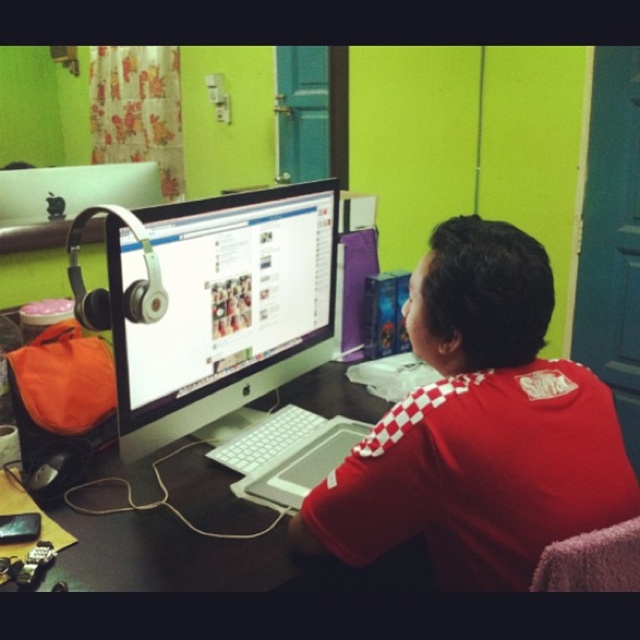
Question: Does red checkered shirt at center appear over white plastic keyboard at center?

Choices:
 (A) no
 (B) yes

Answer: (B)

Question: Which of the following is the farthest from the observer?

Choices:
 (A) (122, 504)
 (B) (292, 406)
 (C) (132, 433)

Answer: (B)

Question: Considering the real-world distances, which object is closest to the white plastic keyboard at center?

Choices:
 (A) red checkered shirt at center
 (B) black glossy table at center

Answer: (B)

Question: Considering the relative positions of white glossy monitor at center and white plastic keyboard at center in the image provided, where is white glossy monitor at center located with respect to white plastic keyboard at center?

Choices:
 (A) below
 (B) above

Answer: (B)

Question: Can you confirm if red checkered shirt at center is wider than white plastic keyboard at center?

Choices:
 (A) yes
 (B) no

Answer: (A)

Question: Which object appears closest to the camera in this image?

Choices:
 (A) white glossy monitor at center
 (B) black glossy table at center

Answer: (B)